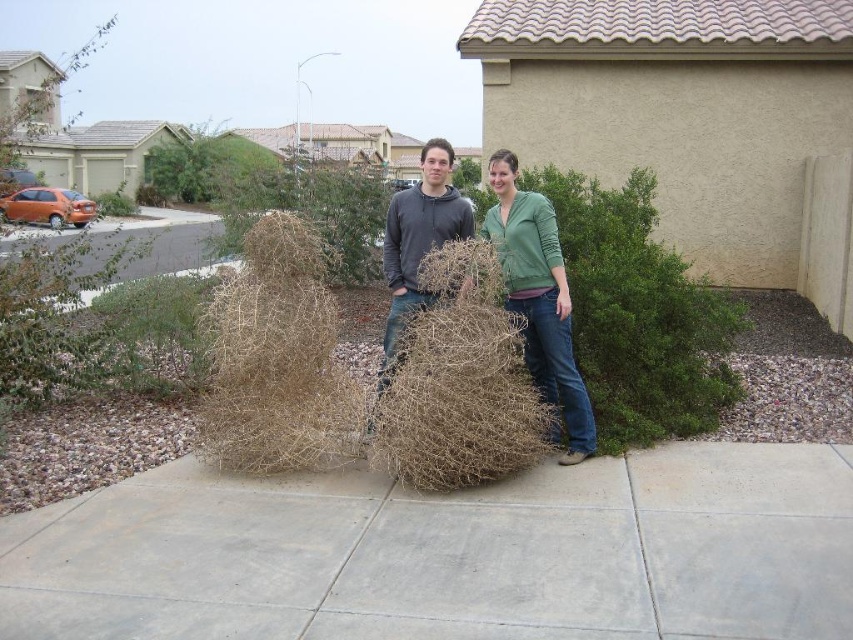
Is brown textured tumbleweed at center smaller than green matte jacket at center?

Incorrect, brown textured tumbleweed at center is not smaller in size than green matte jacket at center.

Who is positioned more to the right, brown textured tumbleweed at center or green matte jacket at center?

From the viewer's perspective, green matte jacket at center appears more on the right side.

You are a GUI agent. You are given a task and a screenshot of the screen. Output one action in this format:
    pyautogui.click(x=<x>, y=<y>)
    Task: Click on the brown textured tumbleweed at center
    The image size is (853, 640).
    Given the screenshot: What is the action you would take?
    pyautogui.click(x=538, y=298)

Is brown textured tumbleweed at center further to camera compared to dark gray hoodie at center?

No, it is not.

Does point (544, 298) come in front of point (448, 156)?

Yes, it is in front of point (448, 156).

Does point (537, 332) come in front of point (434, 140)?

Yes, point (537, 332) is in front of point (434, 140).

Where is `brown textured tumbleweed at center`? brown textured tumbleweed at center is located at coordinates (538, 298).

Can you confirm if dry straw at center is positioned above green matte jacket at center?

Actually, dry straw at center is below green matte jacket at center.

Who is lower down, dry straw at center or green matte jacket at center?

dry straw at center

Who is more distant from viewer, [355,426] or [570,392]?

Positioned behind is point [570,392].

Identify the location of dry straw at center. [x=277, y=360].